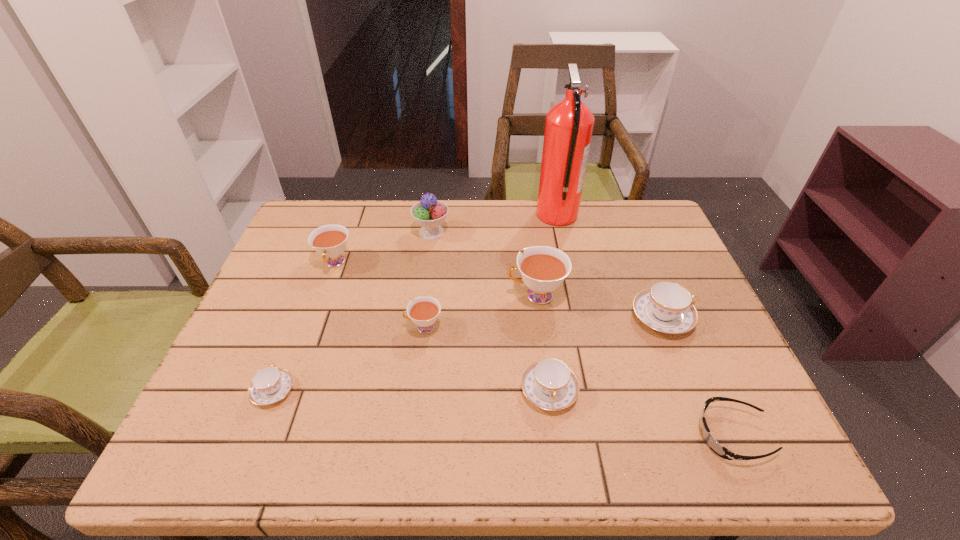
Where is `the tallest object`? Image resolution: width=960 pixels, height=540 pixels. the tallest object is located at coordinates (569, 124).

Find the location of a particular element. the second tallest object is located at coordinates (429, 213).

Find the location of a particular element. The height and width of the screenshot is (540, 960). the rightmost white teacup is located at coordinates (543, 269).

In order to click on the second nearest white teacup in this screenshot , I will do `click(543, 269)`.

At what (x,y) coordinates should I click in order to perform the action: click on the second biggest white teacup. Please return your answer as a coordinate pair (x, y). Looking at the image, I should click on (330, 241).

Identify the location of the third farthest object. click(330, 241).

Locate an element on the screen. the rightmost teacup is located at coordinates (666, 307).

In order to click on the farthest blue teacup in this screenshot , I will do `click(666, 307)`.

Find the location of a particular element. the second white teacup from left to right is located at coordinates (424, 312).

This screenshot has height=540, width=960. I want to click on the nearest white teacup, so point(424,312).